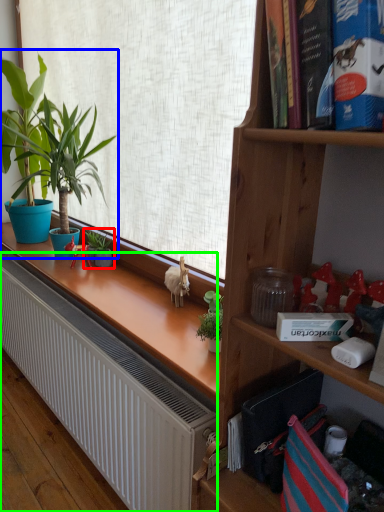
Question: Which is farther away from houseplant (highlighted by a red box)? houseplant (highlighted by a blue box) or radiator (highlighted by a green box)?

Choices:
 (A) houseplant
 (B) radiator

Answer: (B)